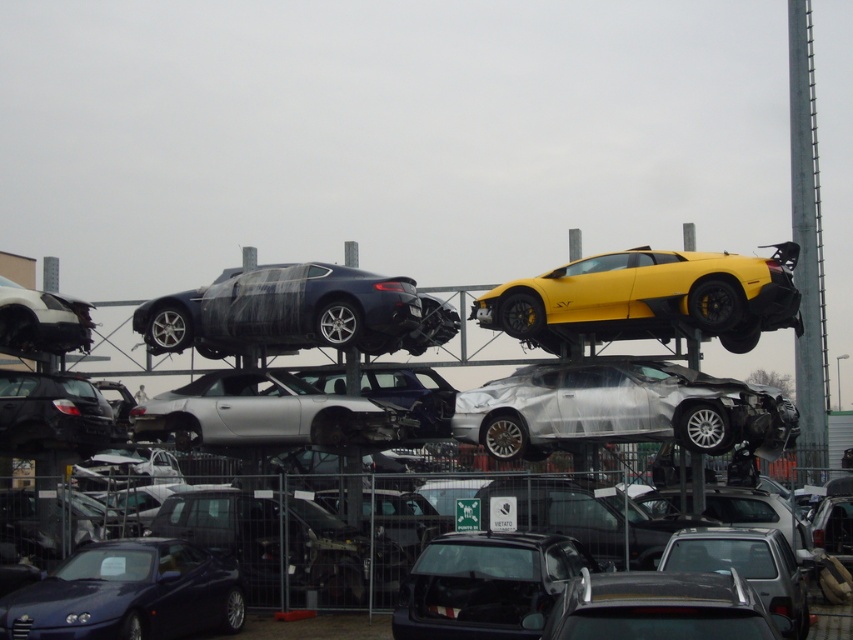
Question: From the image, what is the correct spatial relationship of matte black car at upper center in relation to satin black car at upper center?

Choices:
 (A) right
 (B) left

Answer: (A)

Question: Does matte black car at upper center have a lesser width compared to silver/plastic wrap sports car at center?

Choices:
 (A) no
 (B) yes

Answer: (A)

Question: Based on their relative distances, which object is nearer to the matte black car at upper center?

Choices:
 (A) silver/plastic wrap sports car at center
 (B) yellow matte sports car at upper right
 (C) satin black car at upper center

Answer: (A)

Question: Which point is farther to the camera?

Choices:
 (A) silver/plastic wrap sports car at center
 (B) yellow matte sports car at upper right
 (C) matte black car at upper center

Answer: (A)

Question: Can you confirm if silver/plastic wrap sports car at center is positioned below satin black car at upper center?

Choices:
 (A) yes
 (B) no

Answer: (A)

Question: Among these objects, which one is nearest to the camera?

Choices:
 (A) satin black car at upper center
 (B) matte black car at upper center

Answer: (B)